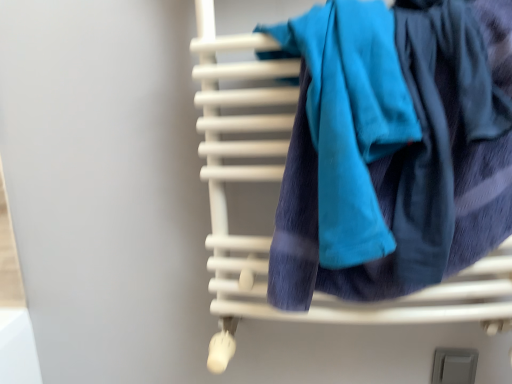
Question: From the image's perspective, relative to white matte towel rack at center, is teal soft towel at center above or below?

Choices:
 (A) below
 (B) above

Answer: (B)

Question: From a real-world perspective, is teal soft towel at center above or below white matte towel rack at center?

Choices:
 (A) below
 (B) above

Answer: (B)

Question: Based on their relative distances, which object is farther from the teal soft towel at center?

Choices:
 (A) white matte towel rack at center
 (B) gray matte switch at lower right

Answer: (B)

Question: Estimate the real-world distances between objects in this image. Which object is farther from the teal soft towel at center?

Choices:
 (A) white matte towel rack at center
 (B) gray matte switch at lower right

Answer: (B)